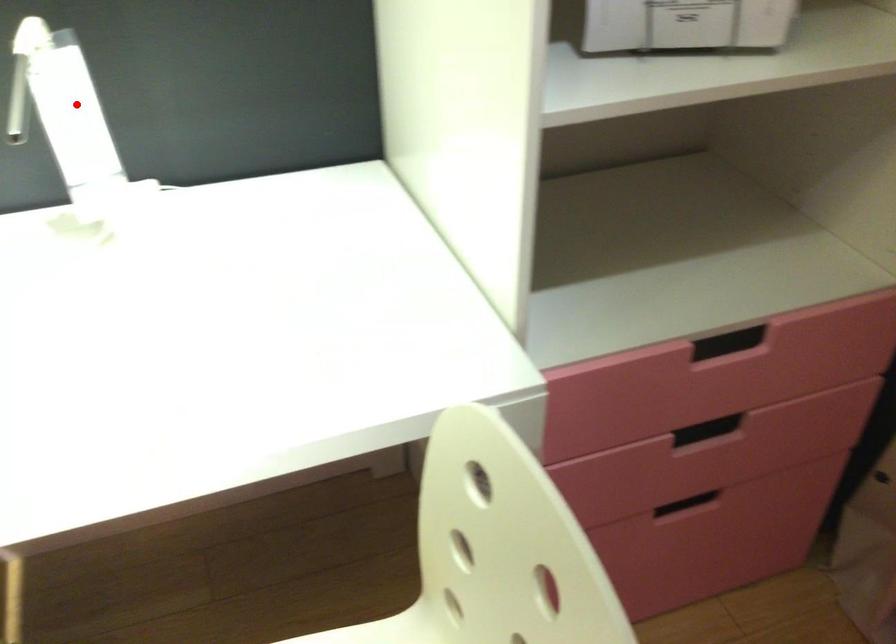
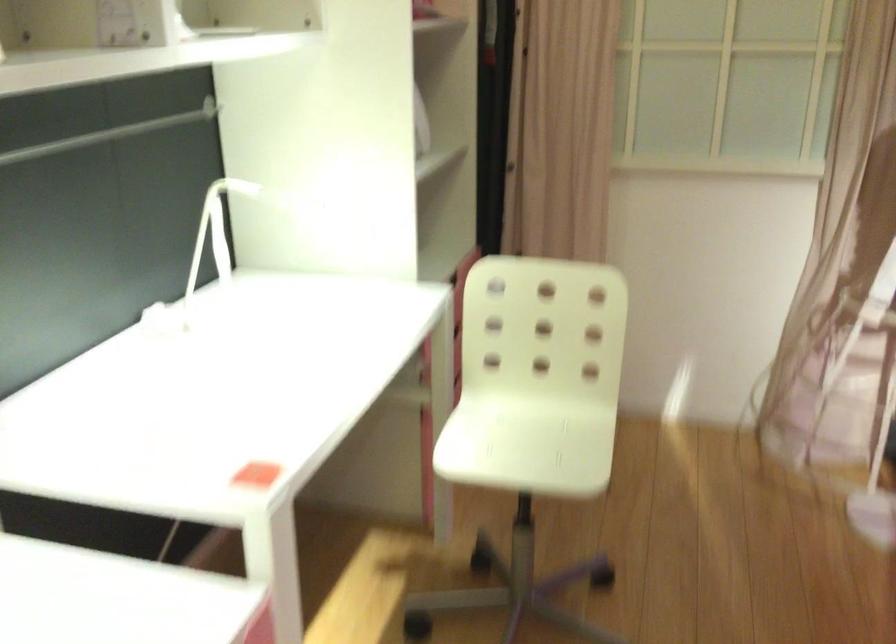
Find the pixel in the second image that matches the highlighted location in the first image.

(213, 234)